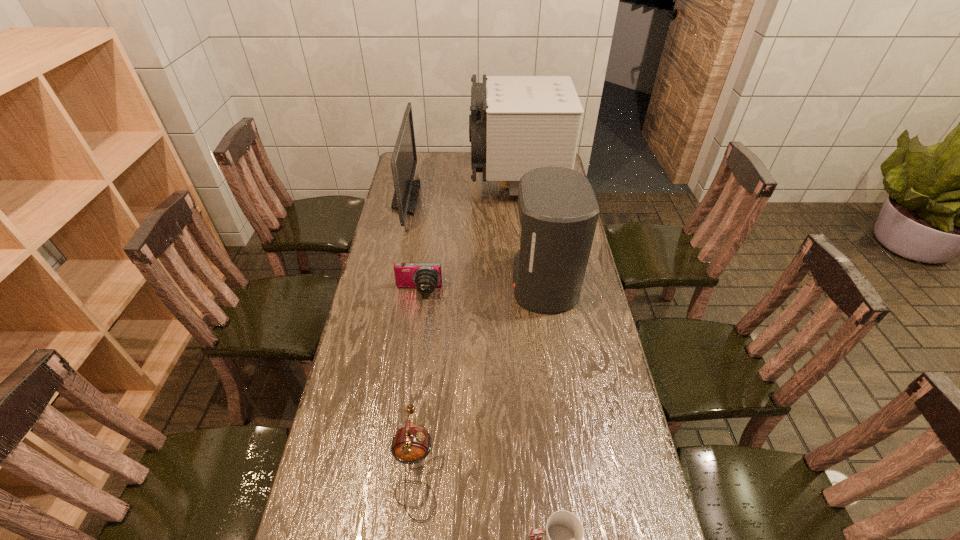
The width and height of the screenshot is (960, 540). Find the location of `fan`. fan is located at coordinates (517, 123).

Find the location of a particular element. coffee maker is located at coordinates (558, 211).

I want to click on monitor, so click(404, 159).

This screenshot has height=540, width=960. I want to click on camera, so click(425, 277).

What are the coordinates of `the second nearest object` in the screenshot? It's located at (411, 444).

Find the location of a particular element. The width and height of the screenshot is (960, 540). vacant area located on the left of the fan is located at coordinates (423, 186).

Locate an element on the screen. The width and height of the screenshot is (960, 540). vacant space located on the button side of the coffee maker is located at coordinates pos(445,284).

Locate an element on the screen. The image size is (960, 540). vacant space situated 0.180m on the button side of the coffee maker is located at coordinates (462, 284).

The height and width of the screenshot is (540, 960). I want to click on vacant region located 0.370m on the button side of the coffee maker, so click(410, 284).

Identify the location of vacant region located on the screen side of the fourth shortest object. Image resolution: width=960 pixels, height=540 pixels. (503, 198).